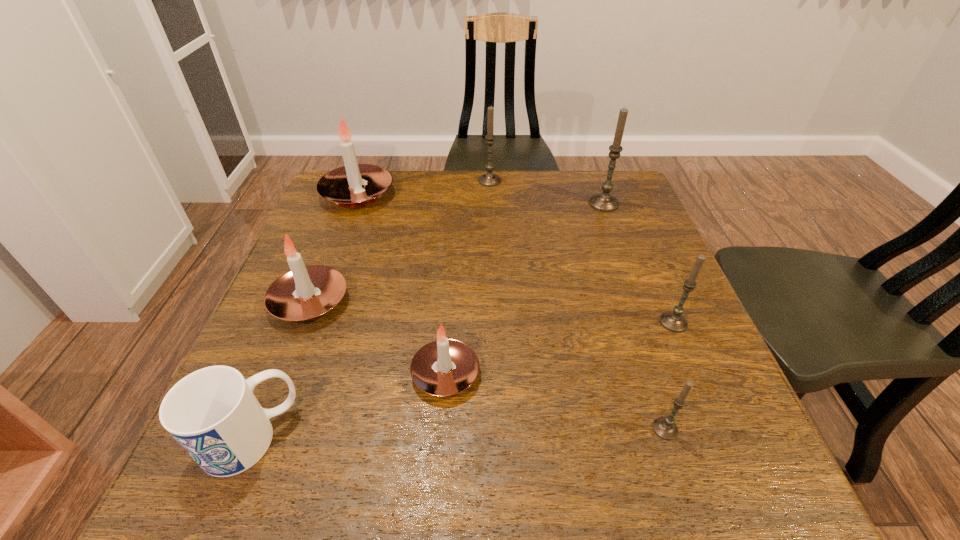
You are a GUI agent. You are given a task and a screenshot of the screen. Output one action in this format:
    pyautogui.click(x=<x>, y=<y>)
    Task: Click on the nearest candle
    This screenshot has width=960, height=540.
    Given the screenshot: What is the action you would take?
    pyautogui.click(x=665, y=427)

Find the location of a particular element. Image resolution: width=960 pixels, height=540 pixels. blue mug is located at coordinates (212, 413).

At what (x,y) coordinates should I click in order to perform the action: click on free point located 0.300m on the front of the biggest gray candle. Please return your answer as a coordinate pair (x, y). This screenshot has height=540, width=960. Looking at the image, I should click on (636, 290).

This screenshot has width=960, height=540. I want to click on vacant space located on the left of the second biggest gray candle, so click(x=380, y=180).

Find the location of `free location located on the front of the biggest white candle`. free location located on the front of the biggest white candle is located at coordinates (341, 239).

Locate an element on the screen. This screenshot has height=540, width=960. free space located 0.300m on the back of the second nearest white candle is located at coordinates (348, 202).

This screenshot has height=540, width=960. I want to click on vacant space located 0.320m on the left of the third farthest gray candle, so click(504, 322).

Where is `vacant region located on the back of the sixth farthest candle`? The width and height of the screenshot is (960, 540). vacant region located on the back of the sixth farthest candle is located at coordinates (455, 229).

Where is `free spot located 0.090m on the right of the nearest gray candle`? Image resolution: width=960 pixels, height=540 pixels. free spot located 0.090m on the right of the nearest gray candle is located at coordinates (732, 429).

You are a GUI agent. You are given a task and a screenshot of the screen. Output one action in this format:
    pyautogui.click(x=<x>, y=<y>)
    Task: Click on the free space located on the right of the mug
    
    Given the screenshot: What is the action you would take?
    pyautogui.click(x=460, y=437)